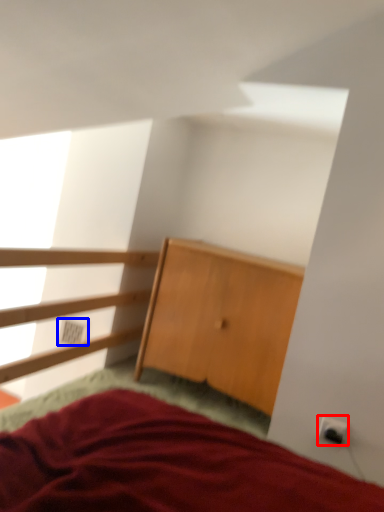
Question: Which point is further to the camera, electric outlet (highlighted by a red box) or electric outlet (highlighted by a blue box)?

Choices:
 (A) electric outlet
 (B) electric outlet

Answer: (B)